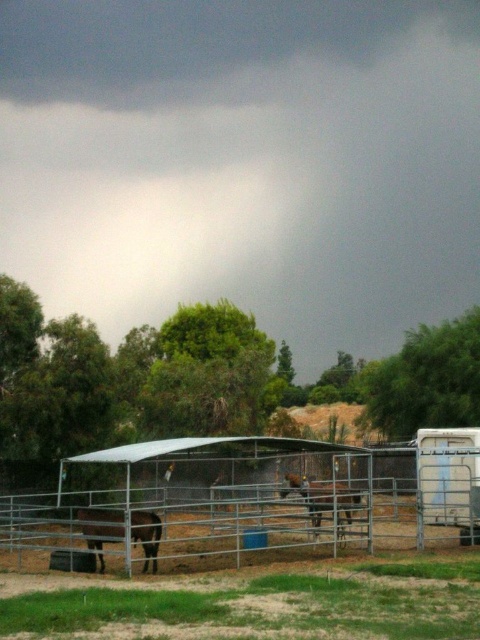
Question: Where is brown glossy horse at lower left located in relation to brown matte horse at center in the image?

Choices:
 (A) right
 (B) left

Answer: (B)

Question: Which is farther from the brown glossy horse at lower left?

Choices:
 (A) metal/galvanized fence at center
 (B) dark gray cloud at upper center

Answer: (B)

Question: Does brown glossy horse at lower left have a smaller size compared to brown matte horse at center?

Choices:
 (A) no
 (B) yes

Answer: (A)

Question: Which is nearer to the brown glossy horse at lower left?

Choices:
 (A) metal/galvanized fence at center
 (B) dark gray cloud at upper center
 (C) brown matte horse at center

Answer: (C)

Question: Which point appears closest to the camera in this image?

Choices:
 (A) (448, 515)
 (B) (312, 492)
 (C) (397, 211)
 (D) (116, 515)

Answer: (D)

Question: Does metal/galvanized fence at center have a larger size compared to brown glossy horse at lower left?

Choices:
 (A) yes
 (B) no

Answer: (A)